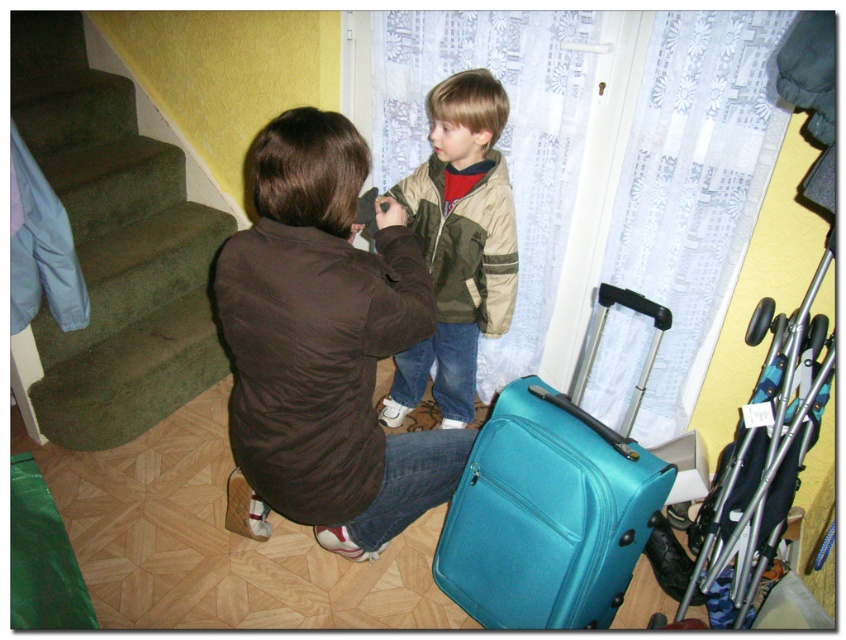
Does brown fabric jacket at center appear on the right side of teal matte suitcase at lower center?

In fact, brown fabric jacket at center is to the left of teal matte suitcase at lower center.

Can you confirm if brown fabric jacket at center is positioned above teal matte suitcase at lower center?

Indeed, brown fabric jacket at center is positioned over teal matte suitcase at lower center.

The height and width of the screenshot is (640, 846). I want to click on brown fabric jacket at center, so click(x=323, y=346).

This screenshot has height=640, width=846. What do you see at coordinates (553, 500) in the screenshot? I see `teal matte suitcase at lower center` at bounding box center [553, 500].

Between point (529, 579) and point (449, 422), which one is positioned in front?

Point (529, 579) is in front.

Where is `teal matte suitcase at lower center`? The width and height of the screenshot is (846, 640). teal matte suitcase at lower center is located at coordinates (553, 500).

Can you confirm if green carpeted stairs at left is positioned above khaki-green jacket at center?

Yes.

The height and width of the screenshot is (640, 846). I want to click on green carpeted stairs at left, so click(113, 244).